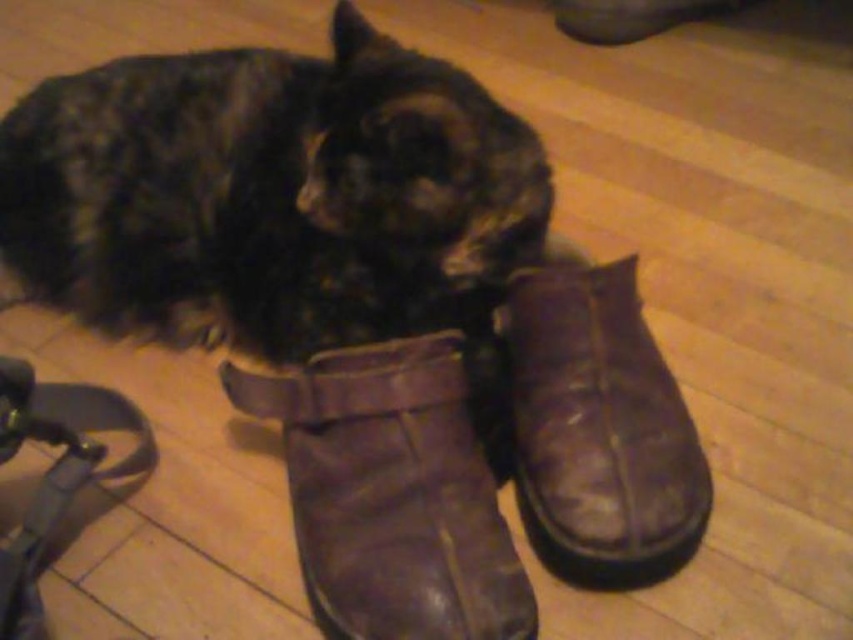
You are taking a photo of the scene and want to focus on both the point at point (387, 250) and the point at point (354, 522). Which point should you focus on first to ensure both are in focus?

You should focus on point (387, 250) first because it is closer to the camera than point (354, 522), ensuring both points are within the depth of field.

You are a photographer setting up a camera to capture the cat in the scene. You need to place a small prop exactly halfway between the two points marked as point (343,307) and point (573,572). Will the prop be closer to the cat or further away from the cat compared to the original points?

The prop placed halfway between point (343,307) and point (573,572) will be closer to the cat than point (573,572) but further than point (343,307). Since point (343,307) is closer to the viewer, the halfway point would still be closer to the cat than the farther point.